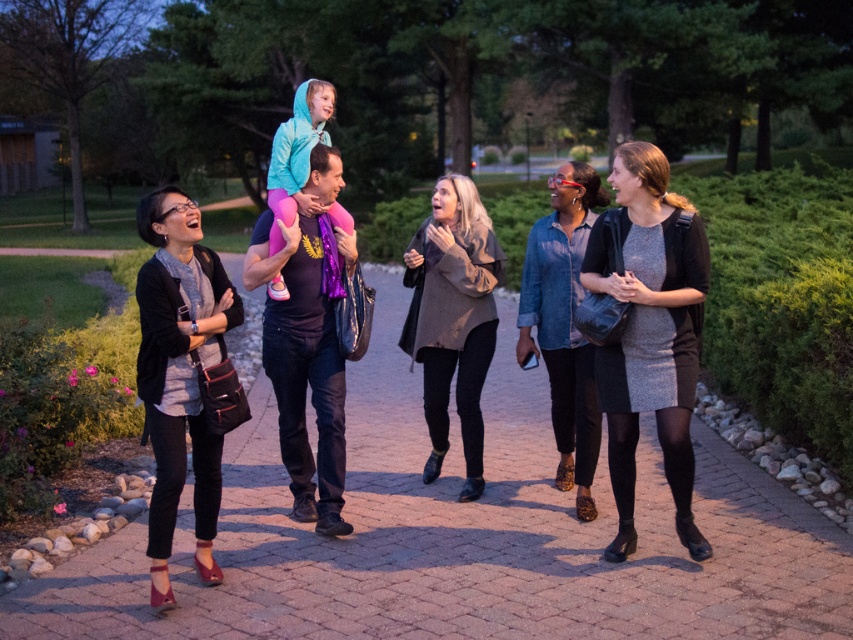
You are a photographer trying to capture a candid shot of the group. Which person should you focus on first to ensure they are in clear view, the matte black jacket at center or the dark gray textured coat at center?

The matte black jacket at center is in front of the dark gray textured coat at center, so focusing on the matte black jacket at center first will ensure it is in clear view.

Based on the photo, you are a photographer trying to capture a photo of the gray knit dress at center and the matte black bag at left. Which object should you focus on first if you want to ensure both are in focus, considering their sizes in the frame?

The gray knit dress at center is taller than the matte black bag at left, so focusing on the gray knit dress at center first would help ensure both are in focus as it is the larger object in the frame.